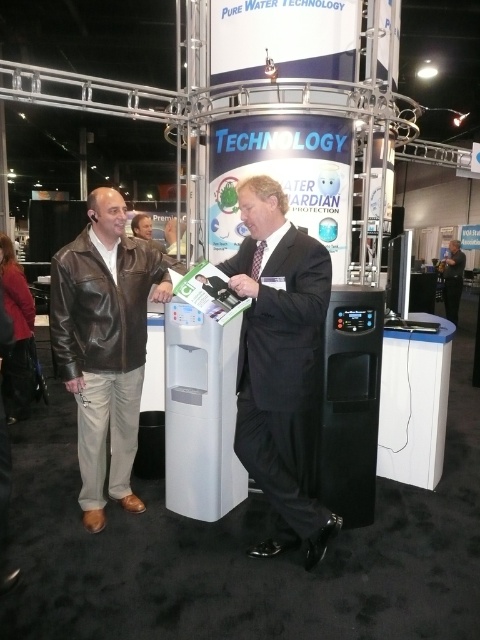
Question: Is dark suit at center above leather jacket at center?

Choices:
 (A) yes
 (B) no

Answer: (B)

Question: Does brown leather jacket at left lie behind dark suit at center?

Choices:
 (A) yes
 (B) no

Answer: (B)

Question: Estimate the real-world distances between objects in this image. Which object is farther from the black suit at center?

Choices:
 (A) leather jacket at center
 (B) brown leather jacket at left
 (C) dark suit at center

Answer: (C)

Question: Among these points, which one is farthest from the camera?

Choices:
 (A) (96, 310)
 (B) (316, 266)
 (C) (447, 317)

Answer: (C)

Question: Does dark suit at center lie behind leather jacket at center?

Choices:
 (A) no
 (B) yes

Answer: (B)

Question: Which of the following is the farthest from the observer?

Choices:
 (A) (81, 504)
 (B) (271, 316)
 (C) (458, 250)
 (D) (143, 237)

Answer: (C)